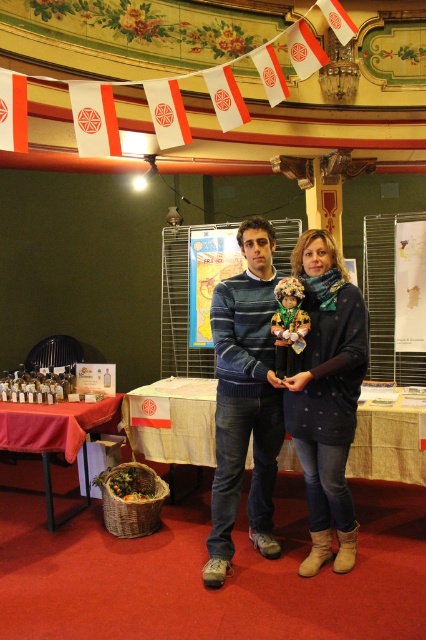
You are an event planner trying to place a decorative item on a table located at point A. The knit sweater at center is currently at point B. If you want to move the sweater to point A, will you have to move it towards the left or right side of the image?

The knit sweater at center is at point B, which is located at coordinates 0.614 on the x and 0.775 on the y. Since point A is not specified, we cannot determine the direction to move the sweater.

You are organizing a small gathering and need to place a large centerpiece on the table that can accommodate a 30cm wide arrangement. Which table between the wooden table at center and the red fabric table at lower left should you choose?

The red fabric table at lower left is larger than the wooden table at center, so you should choose the red fabric table at lower left to place the large centerpiece since it can accommodate a 30cm wide arrangement.